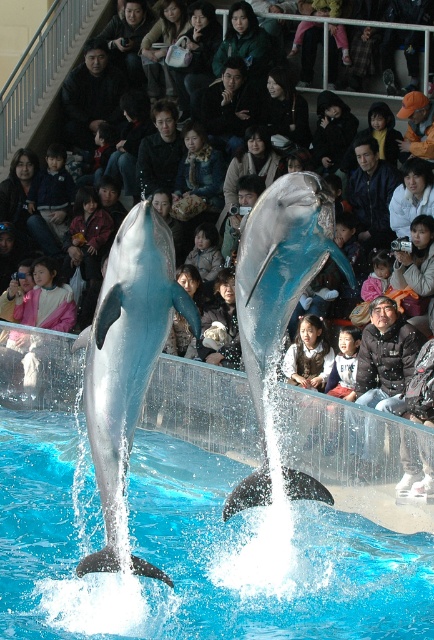
Question: Can you confirm if smooth blue dolphin at center is smaller than black matte jacket at upper center?

Choices:
 (A) yes
 (B) no

Answer: (B)

Question: Is transparent glass water at center thinner than black fabric at center?

Choices:
 (A) yes
 (B) no

Answer: (A)

Question: Does black leather jacket at upper center appear under light blue denim jacket at upper center?

Choices:
 (A) yes
 (B) no

Answer: (B)

Question: Which of the following is the farthest from the observer?

Choices:
 (A) transparent glass water at center
 (B) blue fabric jacket at upper center

Answer: (B)

Question: Which point is farther from the camera taking this photo?

Choices:
 (A) (147, 568)
 (B) (151, 33)
 (C) (387, 298)
 (D) (266, 145)

Answer: (B)

Question: Which object is positioned closest to the blue glossy dolphin at center?

Choices:
 (A) black textured jacket at center
 (B) matte black bag at upper center
 (C) black leather jacket at upper center

Answer: (A)